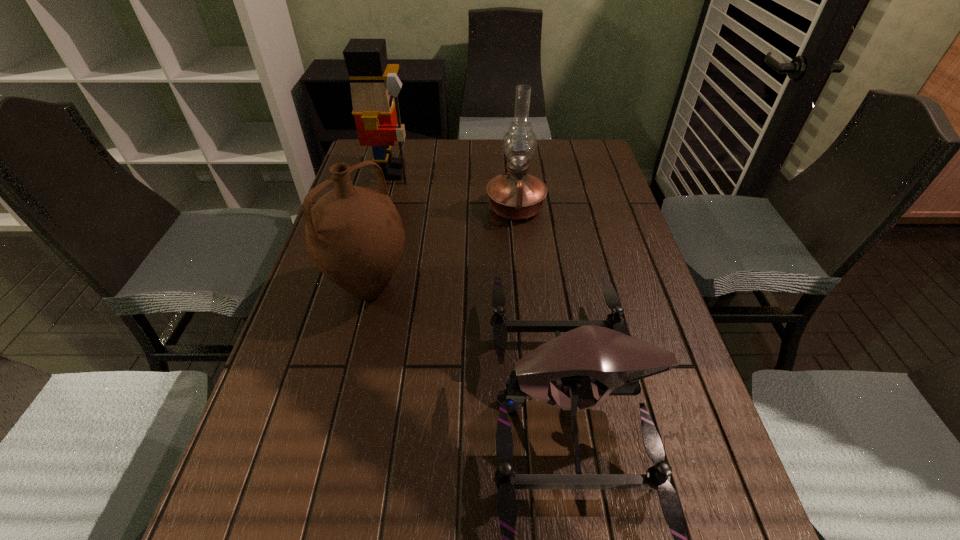
In the image, there is a desktop. Where is `blank space at the far edge`? The width and height of the screenshot is (960, 540). blank space at the far edge is located at coordinates (474, 154).

You are a GUI agent. You are given a task and a screenshot of the screen. Output one action in this format:
    pyautogui.click(x=<x>, y=<y>)
    Task: Click on the vacant area at the left edge
    The height and width of the screenshot is (540, 960).
    Given the screenshot: What is the action you would take?
    (353, 319)

The image size is (960, 540). I want to click on free space at the right edge of the desktop, so tap(666, 342).

I want to click on vacant space at the far right corner, so click(x=560, y=150).

Locate an element on the screen. This screenshot has height=540, width=960. free space between the nutcracker and the third nearest object is located at coordinates (454, 190).

Identify the location of empty space that is in between the nutcracker and the oil lamp. This screenshot has width=960, height=540. (454, 190).

This screenshot has height=540, width=960. What are the coordinates of `free area in between the pitcher and the second farthest object` in the screenshot? It's located at (443, 248).

This screenshot has width=960, height=540. Identify the location of object that stands as the third closest to the farthest object. (594, 358).

Select which object is the second closest to the pitcher. Please provide its 2D coordinates. Your answer should be formatted as a tuple, i.e. [(x, y)], where the tuple contains the x and y coordinates of a point satisfying the conditions above.

[(516, 195)]

Locate an element on the screen. This screenshot has width=960, height=540. free region that satisfies the following two spatial constraints: 1. on the back side of the pitcher; 2. on the left side of the third nearest object is located at coordinates (389, 208).